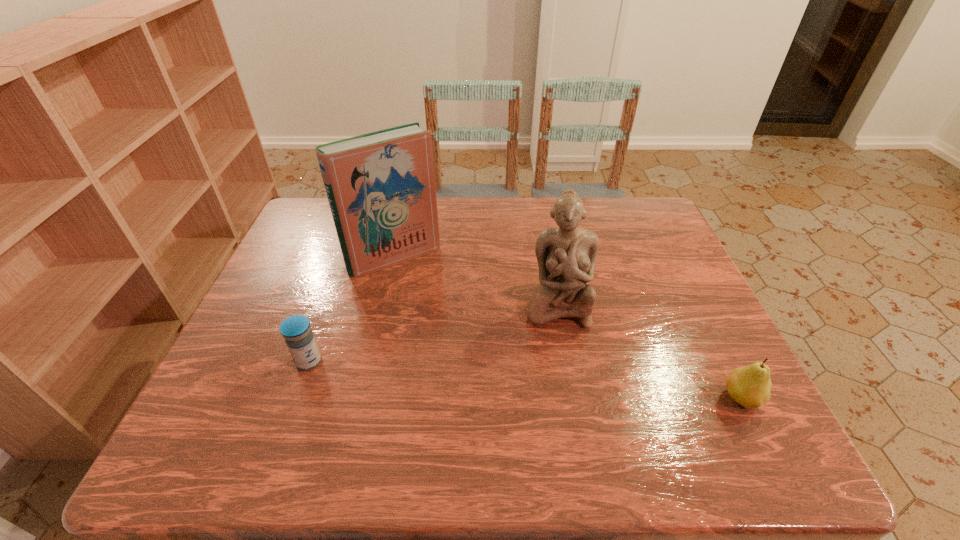
This screenshot has height=540, width=960. I want to click on free spot on the desktop that is between the medicine and the rightmost object and is positioned on the cover of the farthest object, so click(479, 376).

Locate an element on the screen. vacant space on the desktop that is between the second nearest object and the nearest object and is positioned on the front-facing side of the second farthest object is located at coordinates (561, 383).